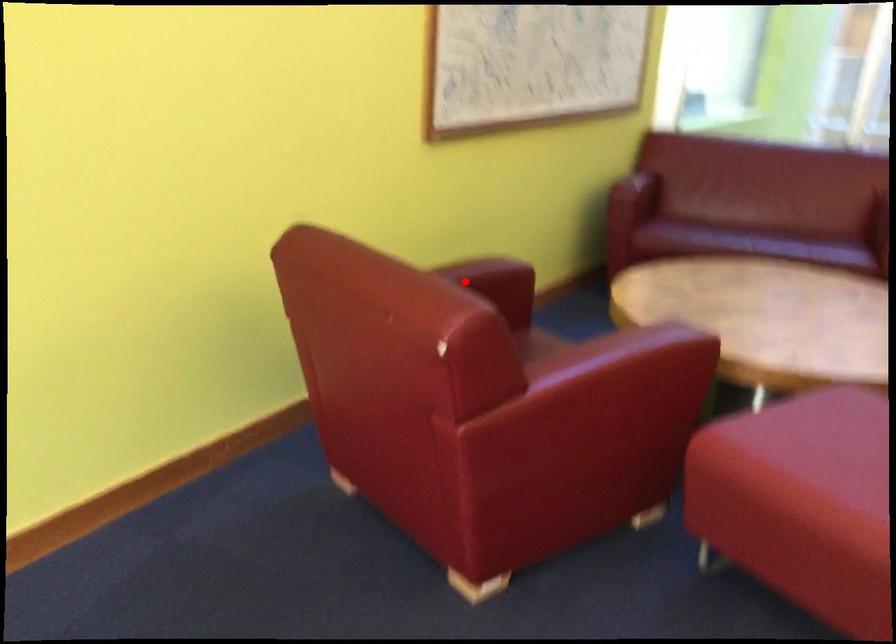
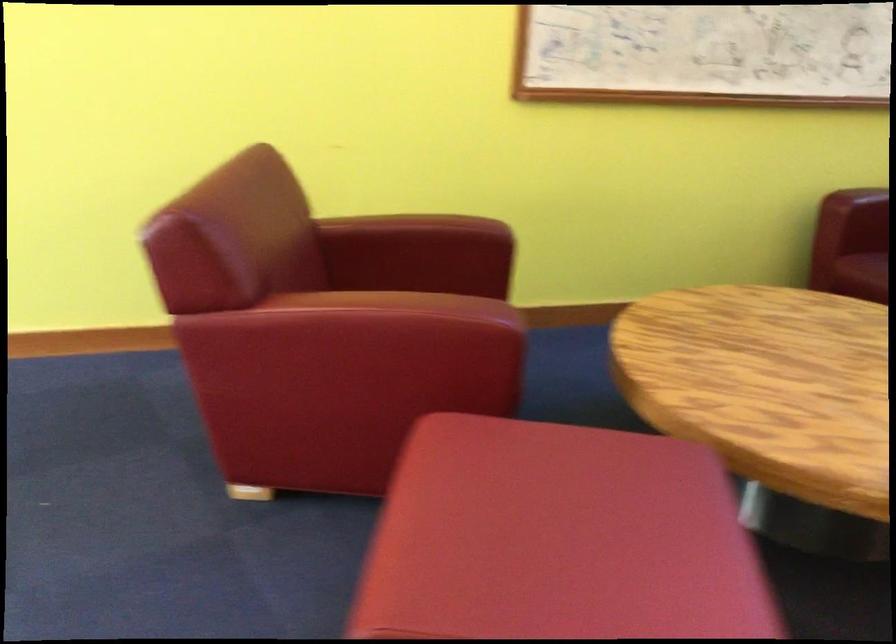
In the second image, find the point that corresponds to the highlighted location in the first image.

(411, 232)